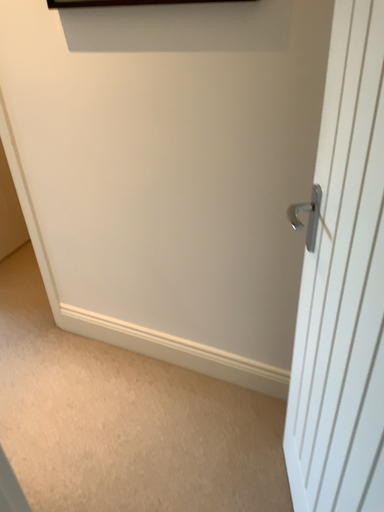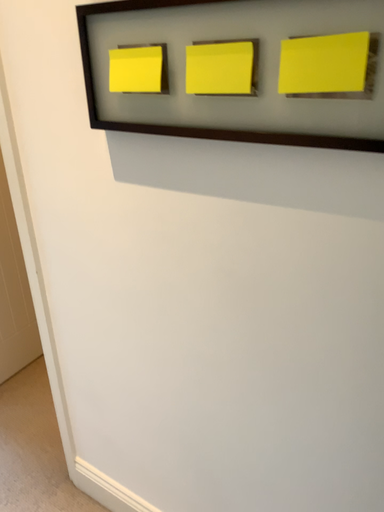
Question: How did the camera likely rotate when shooting the video?

Choices:
 (A) rotated right
 (B) rotated left

Answer: (B)